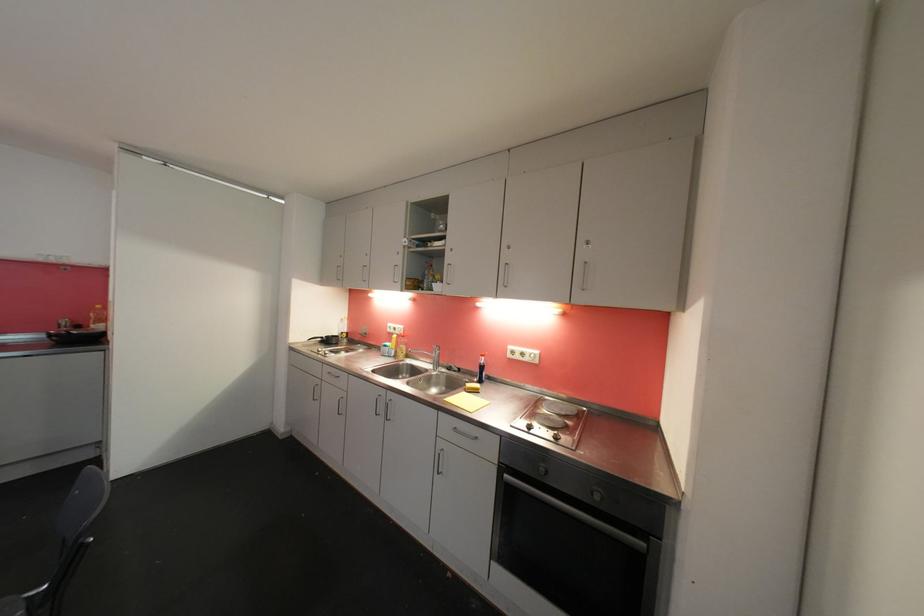
Where would you pull the oven door handle? Please return your answer as a coordinate pair (x, y).

(578, 514)